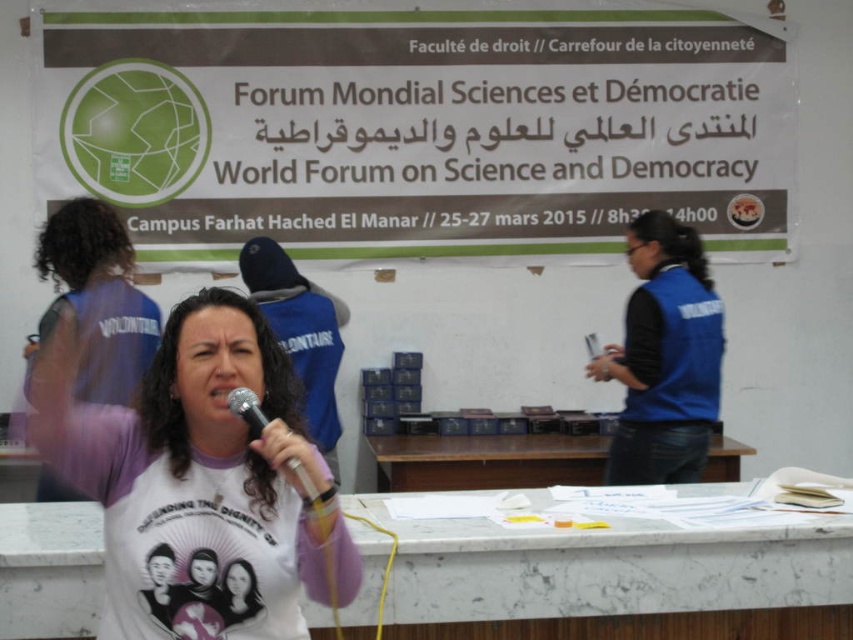
Question: Does white paperboard at upper center lie behind blue fabric vest at center?

Choices:
 (A) no
 (B) yes

Answer: (B)

Question: Can you confirm if white paperboard at upper center is positioned above white cotton shirt at center?

Choices:
 (A) yes
 (B) no

Answer: (A)

Question: Is white paperboard at upper center bigger than metallic silver microphone at center?

Choices:
 (A) yes
 (B) no

Answer: (A)

Question: Which object is closer to the camera taking this photo?

Choices:
 (A) white paperboard at upper center
 (B) blue fabric vest at center
 (C) metallic silver microphone at center
 (D) white cotton shirt at center

Answer: (D)

Question: Which of the following is the closest to the observer?

Choices:
 (A) blue fabric vest at center
 (B) metallic silver microphone at center
 (C) white paperboard at upper center
 (D) white cotton shirt at center

Answer: (D)

Question: Which object is the closest to the blue fabric vest at center?

Choices:
 (A) white paperboard at upper center
 (B) white cotton shirt at center

Answer: (A)